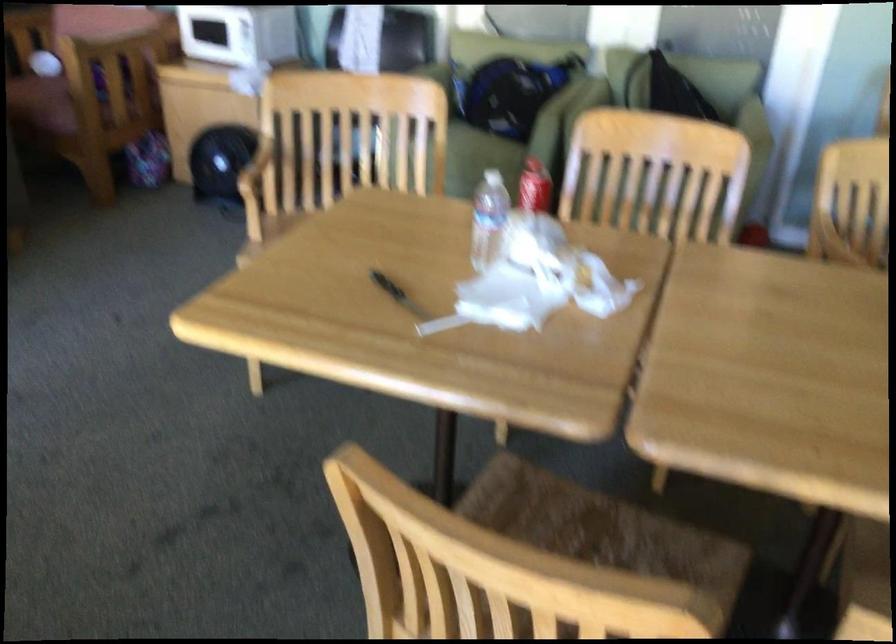
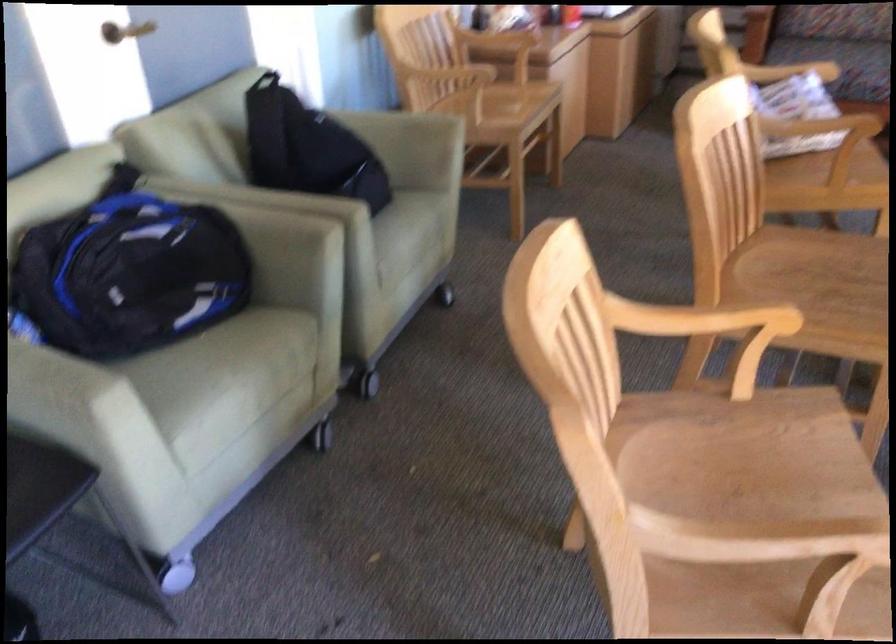
Locate, in the second image, the point that corresponds to (x=532, y=108) in the first image.

(289, 232)